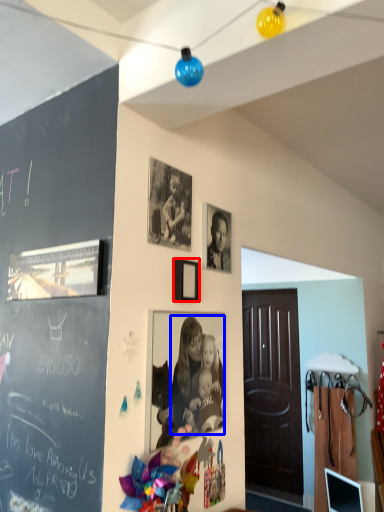
Question: Which of the following is the closest to the observer, picture frame (highlighted by a red box) or person (highlighted by a blue box)?

Choices:
 (A) picture frame
 (B) person

Answer: (B)